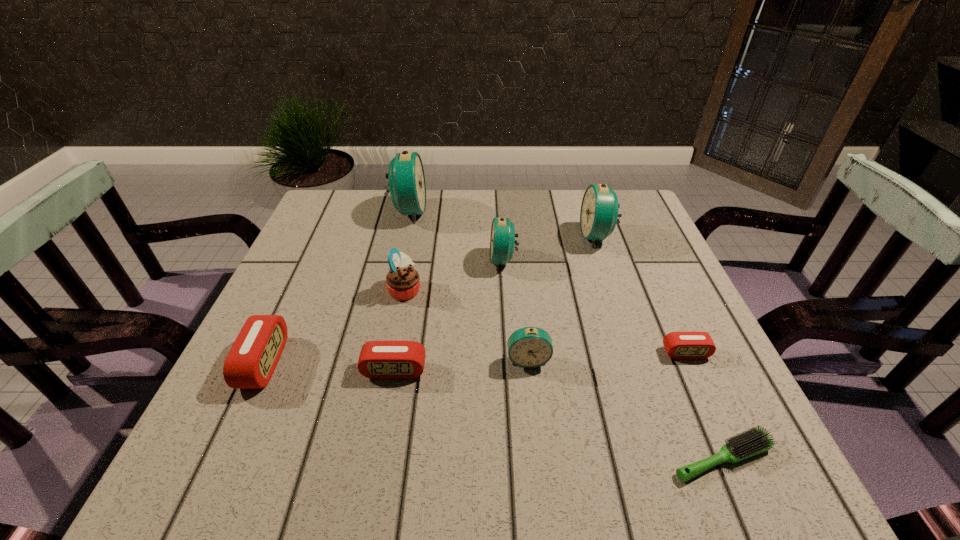
At what (x,y) coordinates should I click in order to perform the action: click on object that stands as the fifth closest to the tallest object. Please return your answer as a coordinate pair (x, y). Image resolution: width=960 pixels, height=540 pixels. Looking at the image, I should click on (378, 359).

Find the location of a particular element. The width and height of the screenshot is (960, 540). object that stands as the fifth closest to the hairbrush is located at coordinates (599, 214).

Image resolution: width=960 pixels, height=540 pixels. Identify the location of the closest alarm clock to the nearest object. (679, 345).

At what (x,y) coordinates should I click in order to perform the action: click on alarm clock object that ranks as the second closest to the fifth tallest alarm clock. Please return your answer as a coordinate pair (x, y). Looking at the image, I should click on (407, 186).

You are a GUI agent. You are given a task and a screenshot of the screen. Output one action in this format:
    pyautogui.click(x=<x>, y=<y>)
    Task: Click on the blue alarm clock identified as the closest to the third shortest object
    
    Given the screenshot: What is the action you would take?
    pyautogui.click(x=529, y=347)

I want to click on the fourth closest blue alarm clock to the leftmost object, so click(x=599, y=214).

The image size is (960, 540). Identify the location of pink alarm clock that is the closest to the biggest pink alarm clock. point(378,359).

Select which pink alarm clock is the second closest to the nearest blue alarm clock. Please provide its 2D coordinates. Your answer should be formatted as a tuple, i.e. [(x, y)], where the tuple contains the x and y coordinates of a point satisfying the conditions above.

[(679, 345)]

Image resolution: width=960 pixels, height=540 pixels. What are the coordinates of `vacant space that satisfies the following two spatial constraints: 1. on the front-facing side of the second smallest blue alarm clock; 2. on the front-facing side of the third shortest object` in the screenshot? It's located at (510, 370).

Locate an element on the screen. The height and width of the screenshot is (540, 960). vacant position in the image that satisfies the following two spatial constraints: 1. on the front-facing side of the nearest object; 2. on the right side of the third shortest object is located at coordinates (378, 458).